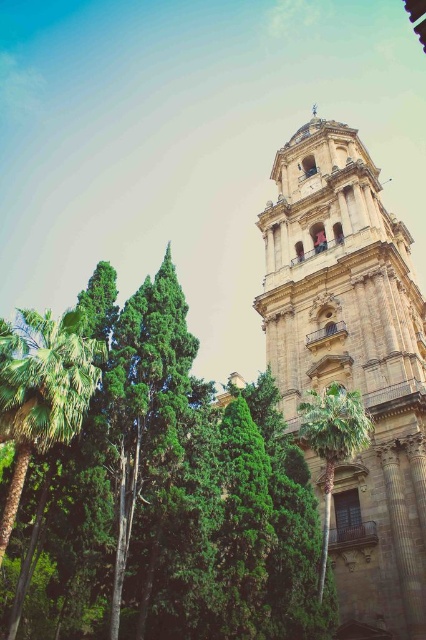
You are an architect designing a new garden layout around the historic church. You need to place a statue between the green leafy tree at center and the green leafy palm tree at lower left. Which tree should the statue be closer to if you want it to be closer to the taller tree?

The statue should be closer to the green leafy tree at center because it is taller than the green leafy palm tree at lower left.

From the picture: You are standing in a garden looking at the green leafy tree at center and the golden stone bell tower at right. Which object is positioned to the left of the other?

The green leafy tree at center is positioned to the left of the golden stone bell tower at right.

You are standing at the center of the image and want to walk towards the green leafy palm tree at lower left. In which direction should you move?

You should move towards the lower left direction to reach the green leafy palm tree at lower left since its 2D location is at point (43,390).